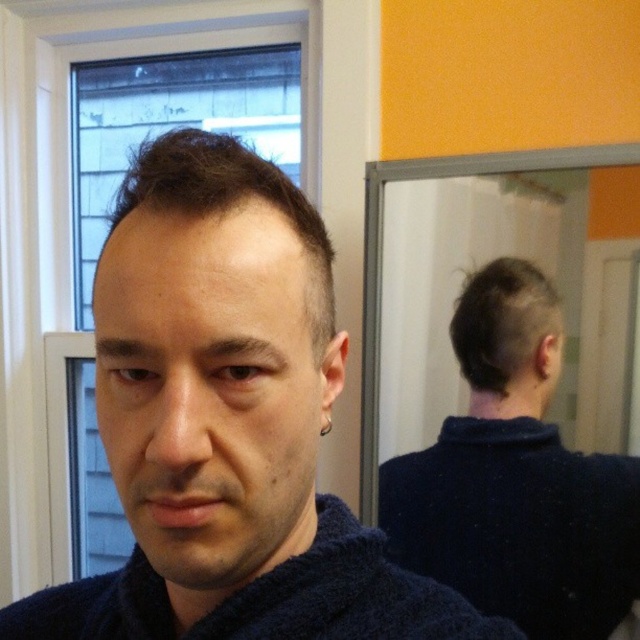
Question: Does dark blue sweater at back have a larger size compared to dark brown textured hair at upper center?

Choices:
 (A) no
 (B) yes

Answer: (B)

Question: Considering the relative positions of dark blue sweater at center and dark matte hair at back in the image provided, where is dark blue sweater at center located with respect to dark matte hair at back?

Choices:
 (A) above
 (B) below

Answer: (B)

Question: Is dark blue sweater at center bigger than dark blue knitted bathrobe at center?

Choices:
 (A) yes
 (B) no

Answer: (A)

Question: Which point appears closest to the camera in this image?

Choices:
 (A) (476, 369)
 (B) (145, 145)

Answer: (B)

Question: Which object appears closest to the camera in this image?

Choices:
 (A) dark matte hair at back
 (B) dark blue sweater at center
 (C) dark blue knitted bathrobe at center

Answer: (B)

Question: Which is nearer to the dark brown textured hair at upper center?

Choices:
 (A) dark blue sweater at back
 (B) dark blue knitted bathrobe at center
 (C) dark matte hair at back

Answer: (B)